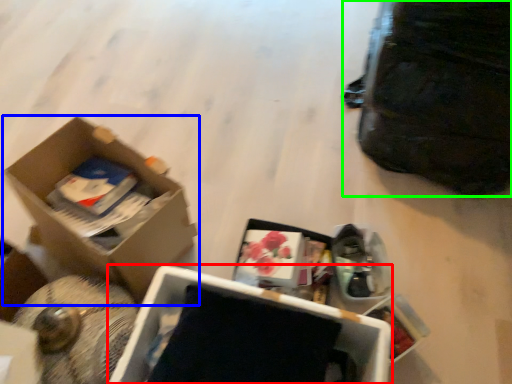
Question: Which object is the farthest from box (highlighted by a red box)? Choose among these: box (highlighted by a blue box) or bag (highlighted by a green box).

Choices:
 (A) box
 (B) bag

Answer: (B)